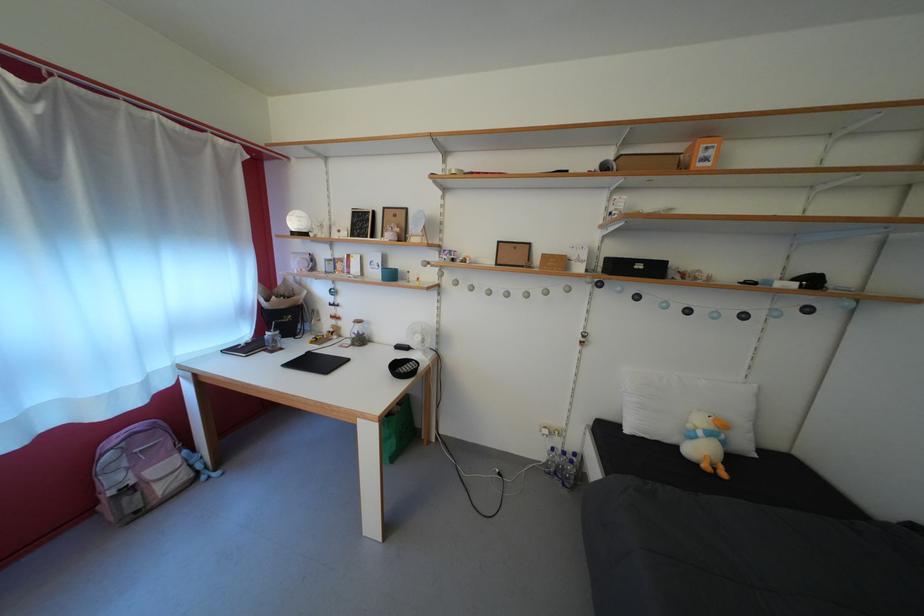
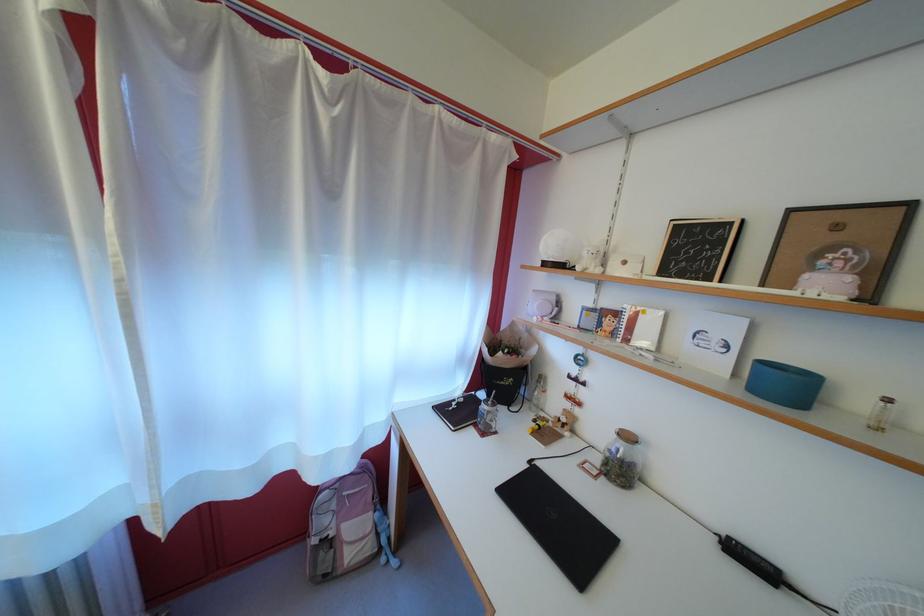
Find the pixel in the second image that matches the point at 368,328 in the first image.

(637, 444)